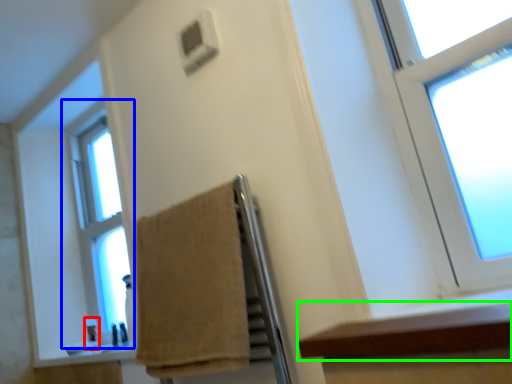
Question: Which object is positioned closest to toiletry (highlighted by a red box)? Select from window (highlighted by a blue box) and ledge (highlighted by a green box).

Choices:
 (A) window
 (B) ledge

Answer: (A)